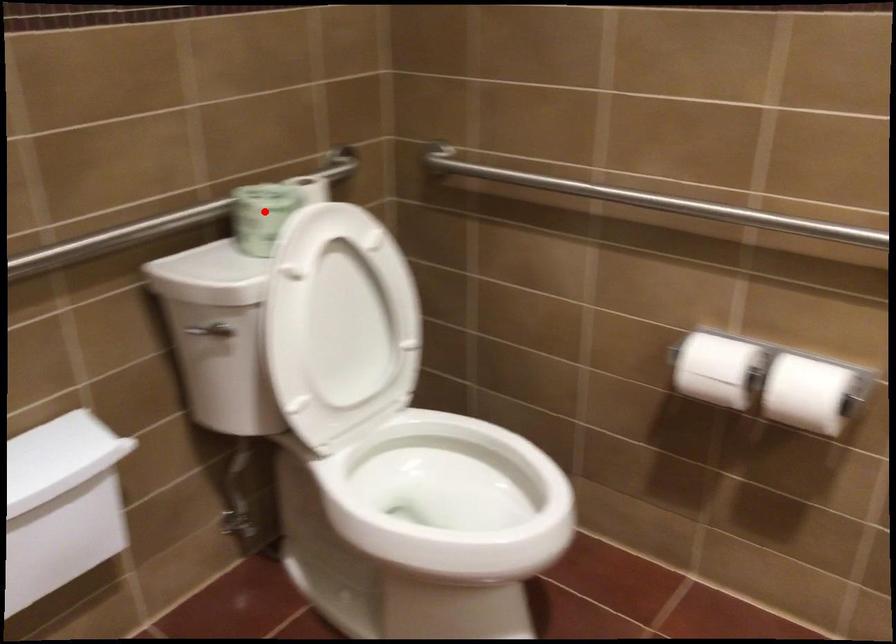
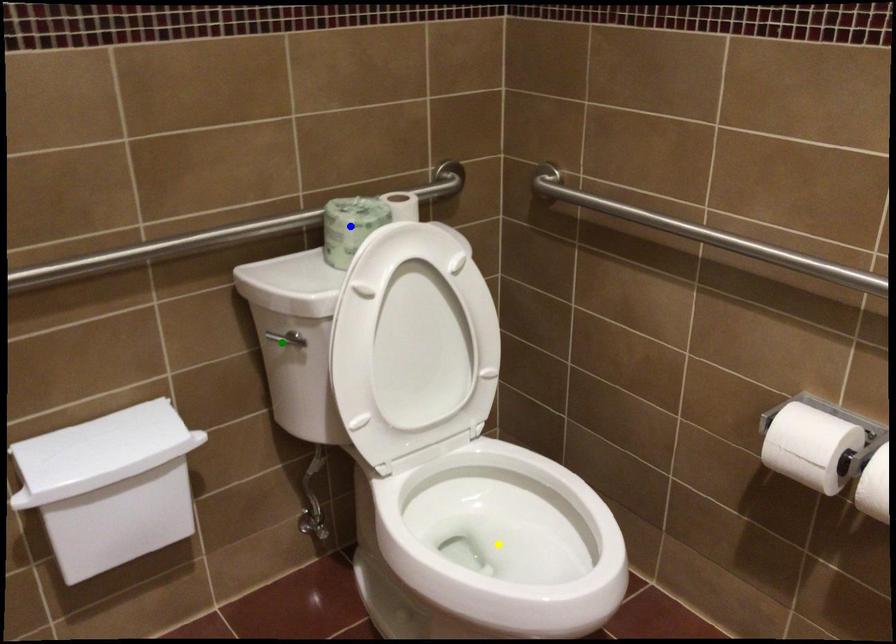
Question: I am providing you with two images of the same scene from different viewpoints. A red point is marked on the first image. You are given multiple points on the second image. Which spot in image 2 lines up with the point in image 1?

Choices:
 (A) yellow point
 (B) green point
 (C) blue point

Answer: (C)